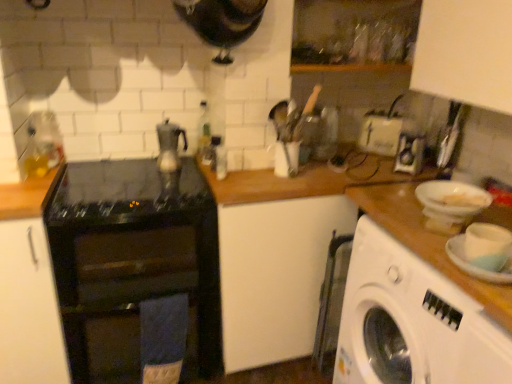
The image size is (512, 384). In order to click on vacant space situated on the left part of white plastic toaster at center, which is the 2th appliance in front-to-back order in this screenshot , I will do `click(347, 148)`.